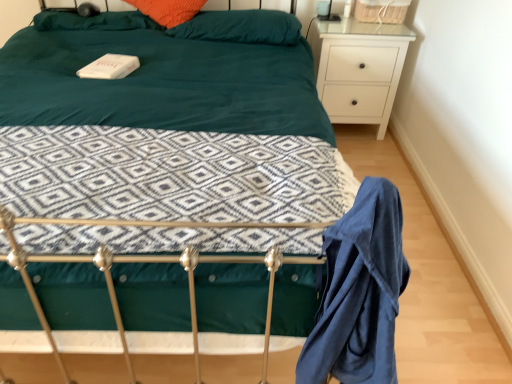
The width and height of the screenshot is (512, 384). What do you see at coordinates (35, 300) in the screenshot? I see `teal fabric bed at center` at bounding box center [35, 300].

The width and height of the screenshot is (512, 384). Find the location of `teal fabric bed at center`. teal fabric bed at center is located at coordinates (35, 300).

I want to click on white matte nightstand at upper right, so click(x=358, y=69).

At what (x,y) coordinates should I click in order to perform the action: click on orange fabric pillow at upper center, which is the second pillow from right to left. Please return your answer as a coordinate pair (x, y). Image resolution: width=512 pixels, height=384 pixels. Looking at the image, I should click on (93, 21).

Describe the element at coordinates (241, 27) in the screenshot. I see `teal fabric pillow at upper center, arranged as the first pillow when viewed from the right` at that location.

Locate an element on the screen. This screenshot has width=512, height=384. blue cotton robe at lower right is located at coordinates (359, 292).

Looking at the image, does white matte nightstand at upper right seem bigger or smaller compared to blue cotton robe at lower right?

Clearly, white matte nightstand at upper right is larger in size than blue cotton robe at lower right.

Based on their positions, is white matte nightstand at upper right located to the left or right of blue cotton robe at lower right?

From the image, it's evident that white matte nightstand at upper right is to the right of blue cotton robe at lower right.

From a real-world perspective, does white matte nightstand at upper right stand above blue cotton robe at lower right?

No, from a real-world perspective, white matte nightstand at upper right is not above blue cotton robe at lower right.

Considering the sizes of white matte nightstand at upper right and teal fabric pillow at upper center, positioned as the 2th pillow in left-to-right order, in the image, is white matte nightstand at upper right taller or shorter than teal fabric pillow at upper center, positioned as the 2th pillow in left-to-right order,?

Considering their sizes, white matte nightstand at upper right has more height than teal fabric pillow at upper center, positioned as the 2th pillow in left-to-right order.

Is white matte nightstand at upper right placed right next to teal fabric pillow at upper center, arranged as the first pillow when viewed from the right?

white matte nightstand at upper right and teal fabric pillow at upper center, arranged as the first pillow when viewed from the right, are clearly separated.

Is teal fabric pillow at upper center, positioned as the 2th pillow in left-to-right order, surrounded by white matte nightstand at upper right?

No.

From the image's perspective, is white matte nightstand at upper right above or below teal fabric pillow at upper center, arranged as the first pillow when viewed from the right?

From the image's perspective, white matte nightstand at upper right appears below teal fabric pillow at upper center, arranged as the first pillow when viewed from the right.

How different are the orientations of blue cotton robe at lower right and orange fabric pillow at upper center, the 1th pillow viewed from the left, in degrees?

The angular difference between blue cotton robe at lower right and orange fabric pillow at upper center, the 1th pillow viewed from the left, is 1.06 degrees.

Based on their positions, is blue cotton robe at lower right located to the left or right of orange fabric pillow at upper center, which is the second pillow from right to left?

In the image, blue cotton robe at lower right appears on the right side of orange fabric pillow at upper center, which is the second pillow from right to left.

Considering their positions, is blue cotton robe at lower right located in front of or behind orange fabric pillow at upper center, the 1th pillow viewed from the left?

Clearly, blue cotton robe at lower right is in front of orange fabric pillow at upper center, the 1th pillow viewed from the left.

Is blue cotton robe at lower right thinner than orange fabric pillow at upper center, which is the second pillow from right to left?

Indeed, blue cotton robe at lower right has a lesser width compared to orange fabric pillow at upper center, which is the second pillow from right to left.

Considering the relative sizes of orange fabric pillow at upper center, which is the second pillow from right to left, and teal fabric pillow at upper center, arranged as the first pillow when viewed from the right, in the image provided, is orange fabric pillow at upper center, which is the second pillow from right to left, taller than teal fabric pillow at upper center, arranged as the first pillow when viewed from the right,?

Incorrect, the height of orange fabric pillow at upper center, which is the second pillow from right to left, is not larger of that of teal fabric pillow at upper center, arranged as the first pillow when viewed from the right.

Is orange fabric pillow at upper center, the 1th pillow viewed from the left, facing towards teal fabric pillow at upper center, arranged as the first pillow when viewed from the right?

No, orange fabric pillow at upper center, the 1th pillow viewed from the left, does not turn towards teal fabric pillow at upper center, arranged as the first pillow when viewed from the right.

Which of these two, orange fabric pillow at upper center, which is the second pillow from right to left, or teal fabric pillow at upper center, arranged as the first pillow when viewed from the right, is bigger?

teal fabric pillow at upper center, arranged as the first pillow when viewed from the right, is bigger.

From the picture: What's the angular difference between orange fabric pillow at upper center, which is the second pillow from right to left, and teal fabric pillow at upper center, positioned as the 2th pillow in left-to-right order,'s facing directions?

The angle between the facing direction of orange fabric pillow at upper center, which is the second pillow from right to left, and the facing direction of teal fabric pillow at upper center, positioned as the 2th pillow in left-to-right order, is 6.61 degrees.

Can you confirm if teal fabric bed at center is wider than blue cotton robe at lower right?

Yes.

From a real-world perspective, which is physically below, teal fabric bed at center or blue cotton robe at lower right?

In real-world perspective, blue cotton robe at lower right is lower.

Is teal fabric bed at center positioned far away from blue cotton robe at lower right?

They are positioned close to each other.

From the image's perspective, between teal fabric bed at center and blue cotton robe at lower right, who is located below?

blue cotton robe at lower right, from the image's perspective.

Does teal fabric bed at center have a larger size compared to teal fabric pillow at upper center, positioned as the 2th pillow in left-to-right order?

Indeed, teal fabric bed at center has a larger size compared to teal fabric pillow at upper center, positioned as the 2th pillow in left-to-right order.

From their relative heights in the image, would you say teal fabric bed at center is taller or shorter than teal fabric pillow at upper center, arranged as the first pillow when viewed from the right?

teal fabric bed at center is taller than teal fabric pillow at upper center, arranged as the first pillow when viewed from the right.

Which is behind, point (293, 5) or point (165, 32)?

The point (293, 5) is farther.

Is teal fabric bed at center at the left side of teal fabric pillow at upper center, arranged as the first pillow when viewed from the right?

Indeed, teal fabric bed at center is positioned on the left side of teal fabric pillow at upper center, arranged as the first pillow when viewed from the right.

Is white matte nightstand at upper right positioned with its back to orange fabric pillow at upper center, which is the second pillow from right to left?

No.

Is white matte nightstand at upper right next to orange fabric pillow at upper center, which is the second pillow from right to left, and touching it?

No, white matte nightstand at upper right is not next to orange fabric pillow at upper center, which is the second pillow from right to left.

Which point is more distant from viewer, (381, 83) or (119, 30)?

The point (381, 83) is farther from the camera.

Image resolution: width=512 pixels, height=384 pixels. I want to click on nightstand directly beneath the blue cotton robe at lower right (from a real-world perspective), so click(358, 69).

In order to click on nightstand behind the teal fabric pillow at upper center, arranged as the first pillow when viewed from the right in this screenshot , I will do `click(358, 69)`.

Which object lies nearer to the anchor point blue cotton robe at lower right, teal fabric bed at center or orange fabric pillow at upper center, the 1th pillow viewed from the left?

The object closer to blue cotton robe at lower right is teal fabric bed at center.

Looking at the image, which one is located further to teal fabric pillow at upper center, arranged as the first pillow when viewed from the right, teal fabric bed at center or blue cotton robe at lower right?

teal fabric bed at center lies further to teal fabric pillow at upper center, arranged as the first pillow when viewed from the right, than the other object.

Based on their spatial positions, is teal fabric bed at center or teal fabric pillow at upper center, positioned as the 2th pillow in left-to-right order, closer to orange fabric pillow at upper center, which is the second pillow from right to left?

teal fabric pillow at upper center, positioned as the 2th pillow in left-to-right order, is closer to orange fabric pillow at upper center, which is the second pillow from right to left.

From the image, which object appears to be farther from orange fabric pillow at upper center, the 1th pillow viewed from the left, teal fabric bed at center or blue cotton robe at lower right?

The object further to orange fabric pillow at upper center, the 1th pillow viewed from the left, is blue cotton robe at lower right.

From the image, which object appears to be nearer to blue cotton robe at lower right, white matte nightstand at upper right or teal fabric pillow at upper center, positioned as the 2th pillow in left-to-right order?

teal fabric pillow at upper center, positioned as the 2th pillow in left-to-right order, is positioned closer to the anchor blue cotton robe at lower right.

Which object lies nearer to the anchor point teal fabric pillow at upper center, positioned as the 2th pillow in left-to-right order, teal fabric bed at center or white matte nightstand at upper right?

white matte nightstand at upper right is closer to teal fabric pillow at upper center, positioned as the 2th pillow in left-to-right order.

Based on the photo, estimate the real-world distances between objects in this image. Which object is further from teal fabric pillow at upper center, arranged as the first pillow when viewed from the right, blue cotton robe at lower right or white matte nightstand at upper right?

Based on the image, blue cotton robe at lower right appears to be further to teal fabric pillow at upper center, arranged as the first pillow when viewed from the right.

From the picture: From the image, which object appears to be farther from blue cotton robe at lower right, white matte nightstand at upper right or orange fabric pillow at upper center, which is the second pillow from right to left?

orange fabric pillow at upper center, which is the second pillow from right to left, is positioned further to the anchor blue cotton robe at lower right.

Where is `pillow between blue cotton robe at lower right and orange fabric pillow at upper center, the 1th pillow viewed from the left, from front to back`? pillow between blue cotton robe at lower right and orange fabric pillow at upper center, the 1th pillow viewed from the left, from front to back is located at coordinates (241, 27).

This screenshot has width=512, height=384. Identify the location of robe between teal fabric bed at center and orange fabric pillow at upper center, the 1th pillow viewed from the left, along the z-axis. (359, 292).

Where is `pillow situated between orange fabric pillow at upper center, the 1th pillow viewed from the left, and white matte nightstand at upper right from left to right`? The height and width of the screenshot is (384, 512). pillow situated between orange fabric pillow at upper center, the 1th pillow viewed from the left, and white matte nightstand at upper right from left to right is located at coordinates (241, 27).

The image size is (512, 384). Find the location of `pillow between teal fabric bed at center and orange fabric pillow at upper center, the 1th pillow viewed from the left, along the z-axis`. pillow between teal fabric bed at center and orange fabric pillow at upper center, the 1th pillow viewed from the left, along the z-axis is located at coordinates (241, 27).